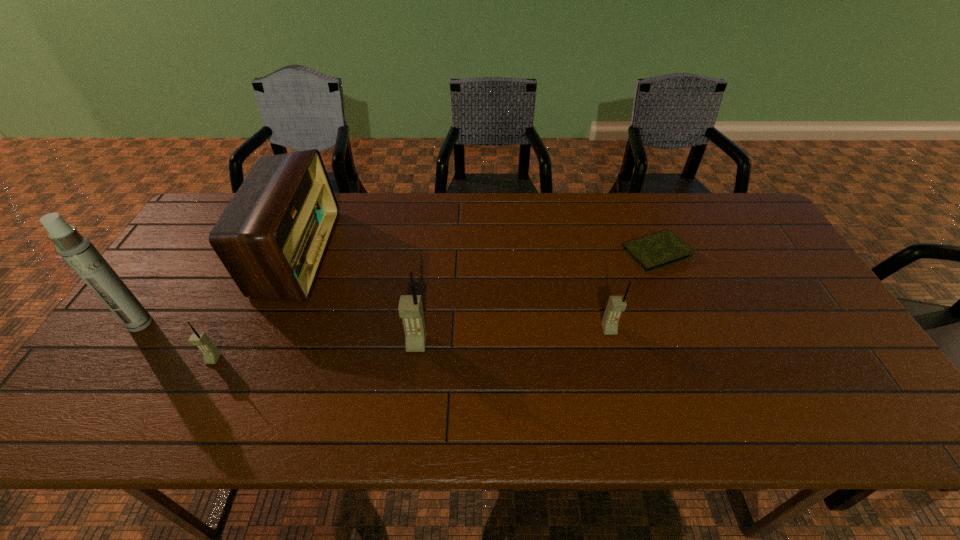
Locate an element on the screen. The image size is (960, 540). the fifth tallest object is located at coordinates (211, 354).

Locate an element on the screen. the nearest cellular telephone is located at coordinates (211, 354).

Locate an element on the screen. the tallest cellular telephone is located at coordinates (410, 307).

Locate an element on the screen. This screenshot has height=540, width=960. the fourth object from left to right is located at coordinates (410, 307).

Where is `the second tallest cellular telephone`? This screenshot has width=960, height=540. the second tallest cellular telephone is located at coordinates (616, 304).

Image resolution: width=960 pixels, height=540 pixels. I want to click on the fifth object from left to right, so click(x=616, y=304).

The width and height of the screenshot is (960, 540). I want to click on the rightmost object, so click(656, 251).

Identify the location of the shortest object. pos(656,251).

Identify the location of radio receiver. The width and height of the screenshot is (960, 540). (272, 237).

You are a GUI agent. You are given a task and a screenshot of the screen. Output one action in this format:
    pyautogui.click(x=<x>, y=<y>)
    Task: Click on the leftmost object
    
    Given the screenshot: What is the action you would take?
    click(77, 250)